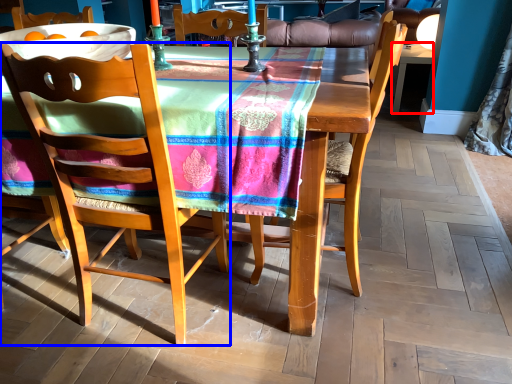
Question: Which point is closer to the camera, desk (highlighted by a red box) or chair (highlighted by a blue box)?

Choices:
 (A) desk
 (B) chair

Answer: (B)